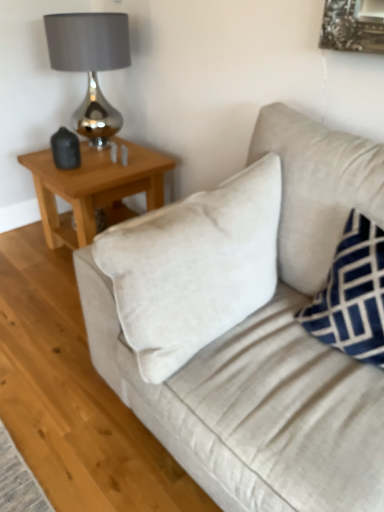
Question: Does light brown wooden table at upper left appear on the left side of beige fabric couch at center?

Choices:
 (A) no
 (B) yes

Answer: (B)

Question: Can you confirm if light brown wooden table at upper left is wider than beige fabric couch at center?

Choices:
 (A) yes
 (B) no

Answer: (B)

Question: Is light brown wooden table at upper left positioned with its back to beige fabric couch at center?

Choices:
 (A) no
 (B) yes

Answer: (A)

Question: Considering the relative sizes of light brown wooden table at upper left and beige fabric couch at center in the image provided, is light brown wooden table at upper left bigger than beige fabric couch at center?

Choices:
 (A) no
 (B) yes

Answer: (A)

Question: From the image's perspective, would you say light brown wooden table at upper left is positioned over beige fabric couch at center?

Choices:
 (A) no
 (B) yes

Answer: (B)

Question: Does point (211, 400) appear closer or farther from the camera than point (362, 348)?

Choices:
 (A) farther
 (B) closer

Answer: (B)

Question: Based on their positions, is beige fabric couch at center located to the left or right of blue velvet pillow at right?

Choices:
 (A) right
 (B) left

Answer: (B)

Question: From a real-world perspective, is beige fabric couch at center above or below blue velvet pillow at right?

Choices:
 (A) above
 (B) below

Answer: (B)

Question: Is beige fabric couch at center inside the boundaries of blue velvet pillow at right, or outside?

Choices:
 (A) outside
 (B) inside

Answer: (A)

Question: Does point pyautogui.click(x=321, y=334) appear closer or farther from the camera than point pyautogui.click(x=36, y=152)?

Choices:
 (A) farther
 (B) closer

Answer: (B)

Question: Is blue velvet pillow at right bigger or smaller than light brown wooden table at upper left?

Choices:
 (A) small
 (B) big

Answer: (A)

Question: From the image's perspective, is blue velvet pillow at right above or below light brown wooden table at upper left?

Choices:
 (A) above
 (B) below

Answer: (B)

Question: In terms of width, does blue velvet pillow at right look wider or thinner when compared to light brown wooden table at upper left?

Choices:
 (A) wide
 (B) thin

Answer: (B)

Question: Which is correct: blue velvet pillow at right is inside beige fabric couch at center, or outside of it?

Choices:
 (A) outside
 (B) inside

Answer: (B)

Question: In terms of size, does blue velvet pillow at right appear bigger or smaller than beige fabric couch at center?

Choices:
 (A) big
 (B) small

Answer: (B)